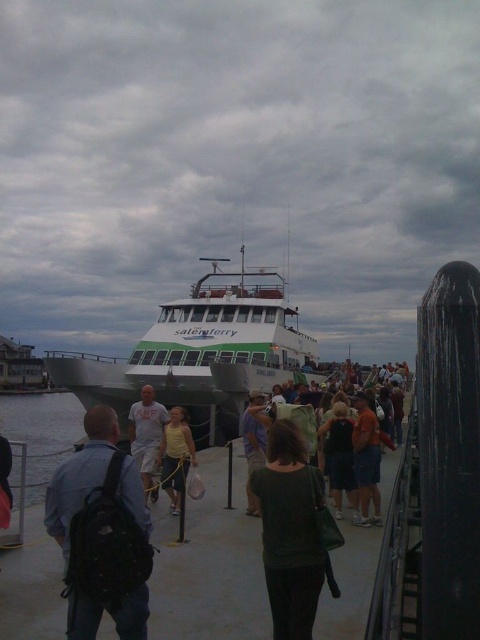
Can you confirm if dark gray fabric crowd at center is smaller than light gray cotton shirt at center?

No, dark gray fabric crowd at center is not smaller than light gray cotton shirt at center.

Between point (400, 403) and point (153, 410), which one is positioned in front?

Point (153, 410) is in front.

Identify the location of dark gray fabric crowd at center. (373, 442).

Where is `dark gray fabric crowd at center`? This screenshot has height=640, width=480. dark gray fabric crowd at center is located at coordinates (373, 442).

Based on the photo, which is below, matte black backpack at center or dark gray fabric crowd at center?

matte black backpack at center is below.

Can you confirm if matte black backpack at center is shorter than dark gray fabric crowd at center?

No, matte black backpack at center is not shorter than dark gray fabric crowd at center.

Identify the location of matte black backpack at center. The height and width of the screenshot is (640, 480). (101, 532).

Between point (120, 509) and point (144, 442), which one is positioned in front?

Point (120, 509) is more forward.

Which is behind, point (108, 433) or point (142, 467)?

The point (142, 467) is more distant.

Identify the location of matte black backpack at center. click(x=101, y=532).